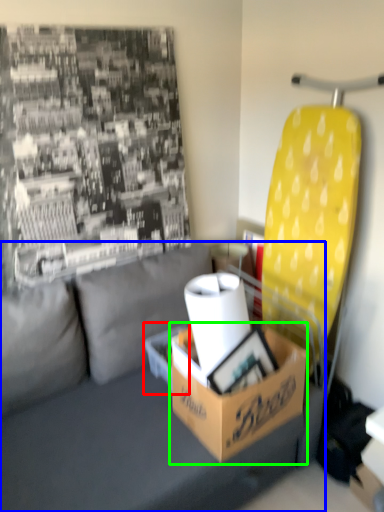
Question: Which object is the farthest from cardboard box (highlighted by a red box)? Choose among these: studio couch (highlighted by a blue box) or box (highlighted by a green box).

Choices:
 (A) studio couch
 (B) box

Answer: (B)